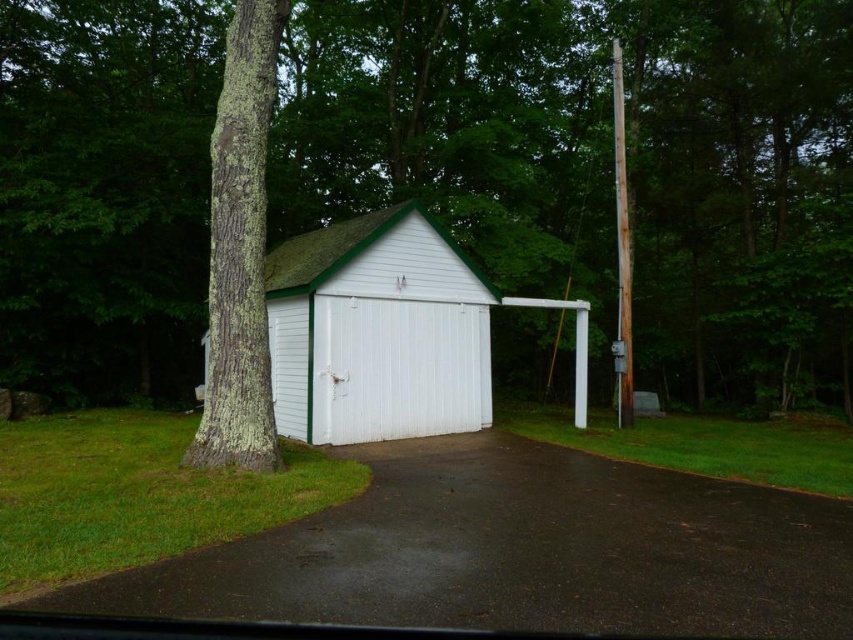
Question: Based on their relative distances, which object is farther from the green rough bark tree at left?

Choices:
 (A) green lichen-covered tree trunk at left
 (B) white corrugated metal garage door at center

Answer: (A)

Question: Is green rough bark tree at left below dark asphalt driveway at center?

Choices:
 (A) yes
 (B) no

Answer: (B)

Question: Does green rough bark tree at left have a smaller size compared to white corrugated metal garage door at center?

Choices:
 (A) yes
 (B) no

Answer: (B)

Question: Which point is closer to the camera?

Choices:
 (A) green rough bark tree at left
 (B) white corrugated metal garage door at center
 (C) green lichen-covered tree trunk at left
 (D) white woodshed at center

Answer: (C)

Question: Which of the following is the closest to the observer?

Choices:
 (A) (619, 524)
 (B) (619, 337)
 (C) (314, 381)
 (D) (252, 406)

Answer: (A)

Question: Is white corrugated metal garage door at center closer to the viewer compared to rusty wood pole at right?

Choices:
 (A) no
 (B) yes

Answer: (B)